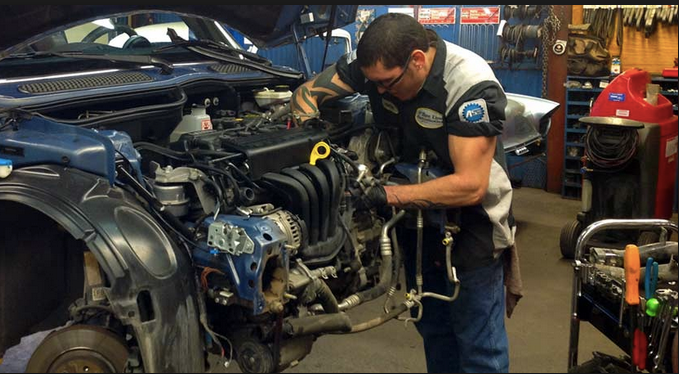
Locate an element on the screen. The width and height of the screenshot is (679, 374). floor is located at coordinates (381, 349).